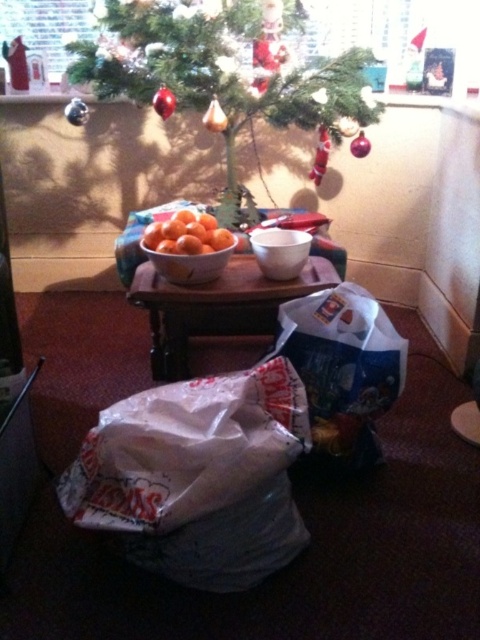
You are a delivery person who just arrived with a package. You need to place the package on the wooden table at center. The package is 4 feet long. Can you fit it on the table without overlapping the Christmas tree?

The wooden table at center has a length of 4.44 feet, so yes, the package can be placed on the wooden table at center without overlapping the Christmas tree as it is slightly longer than the package.